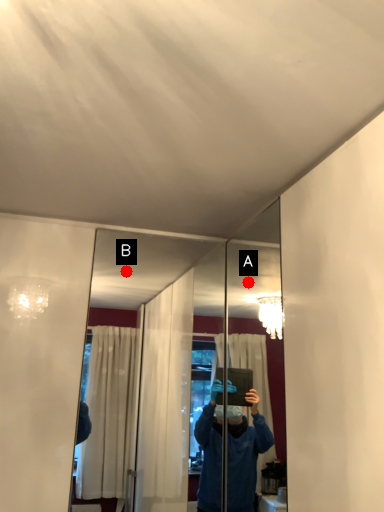
Question: Two points are circled on the image, labeled by A and B beside each circle. Which point is closer to the camera?

Choices:
 (A) A is closer
 (B) B is closer

Answer: (B)